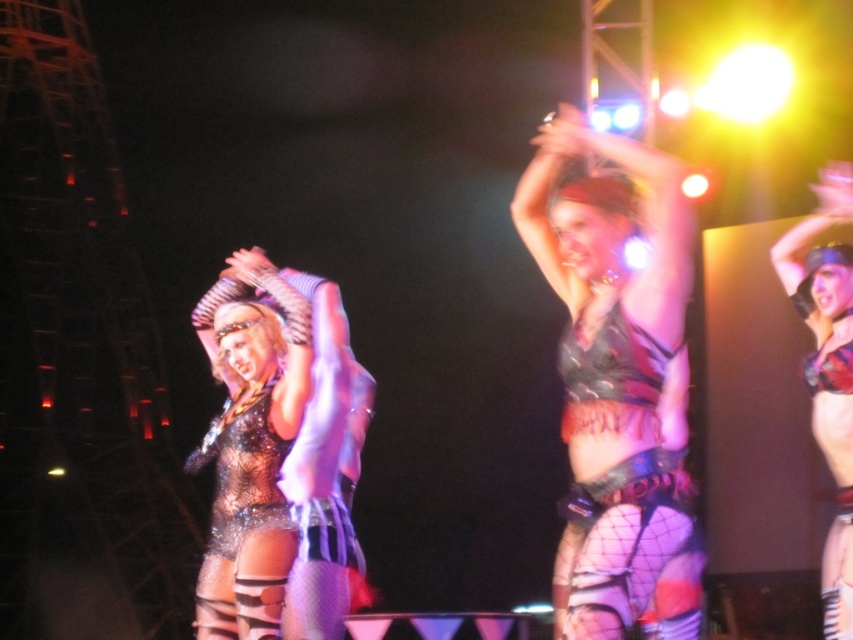
Question: Does shiny red bikini at upper right appear under shiny metallic outfit at center?

Choices:
 (A) no
 (B) yes

Answer: (A)

Question: Which point is closer to the camera?

Choices:
 (A) leather-like black and purple shorts at center
 (B) shiny metallic bikini at upper right
 (C) shiny red bikini at upper right

Answer: (A)

Question: Is metallic silver top at center to the left of glittery sequined outfit at center from the viewer's perspective?

Choices:
 (A) no
 (B) yes

Answer: (A)

Question: Which point is farther to the camera?

Choices:
 (A) shiny metallic outfit at center
 (B) shiny metallic bikini at upper right

Answer: (B)

Question: Which of the following is the closest to the observer?

Choices:
 (A) leather-like black and purple shorts at center
 (B) metallic silver top at center
 (C) glittery mesh bodysuit at center

Answer: (A)

Question: Does metallic silver top at center come in front of leather-like black and purple shorts at center?

Choices:
 (A) no
 (B) yes

Answer: (A)